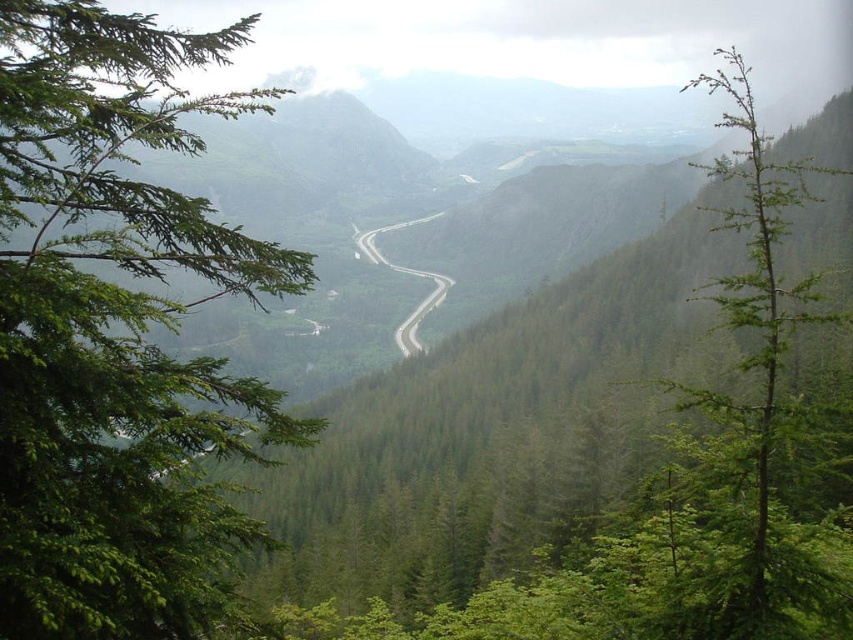
Does point (169, 273) lie in front of point (376, 230)?

Yes.

Between point (184, 208) and point (434, 280), which one is positioned in front?

Point (184, 208) is in front.

Locate an element on the screen. This screenshot has width=853, height=640. green leafy tree at left is located at coordinates (119, 336).

Is green needle-like tree at right thinner than green asphalt road at center?

Incorrect, green needle-like tree at right's width is not less than green asphalt road at center's.

From the picture: Does green needle-like tree at right appear over green asphalt road at center?

Yes.

Is point (727, 426) less distant than point (370, 230)?

Yes.

Image resolution: width=853 pixels, height=640 pixels. I want to click on green needle-like tree at right, so click(746, 428).

Is point (277, 420) more distant than point (659, 547)?

Yes, point (277, 420) is farther from viewer.

Between green leafy tree at left and green needle-like tree at right, which one is positioned higher?

green needle-like tree at right is higher up.

Does point (196, 360) come farther from viewer compared to point (721, 296)?

Yes, it is.

Where is `green leafy tree at left`? The height and width of the screenshot is (640, 853). green leafy tree at left is located at coordinates (119, 336).